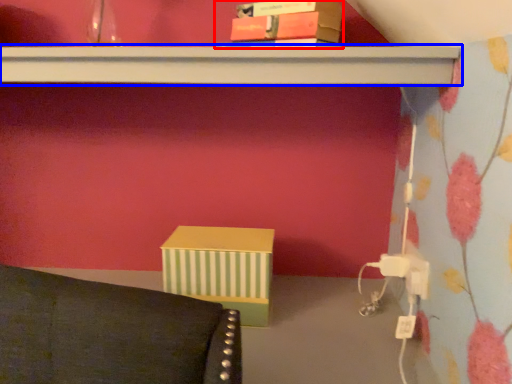
Question: Which point is further to the camera, book (highlighted by a red box) or shelf (highlighted by a blue box)?

Choices:
 (A) book
 (B) shelf

Answer: (A)